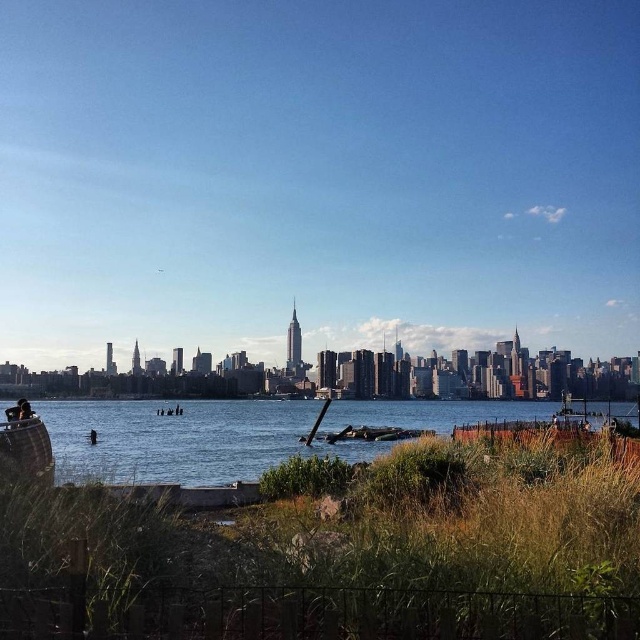
Question: From the image, what is the correct spatial relationship of clear blue water at lower center in relation to wooden boat at lower left?

Choices:
 (A) below
 (B) above

Answer: (B)

Question: Is clear blue water at lower center to the left of wooden boat at lower left from the viewer's perspective?

Choices:
 (A) no
 (B) yes

Answer: (A)

Question: Among these objects, which one is farthest from the camera?

Choices:
 (A) wooden boat at lower left
 (B) clear blue water at lower center

Answer: (A)

Question: Observing the image, what is the correct spatial positioning of clear blue water at lower center in reference to wooden boat at lower left?

Choices:
 (A) left
 (B) right

Answer: (B)